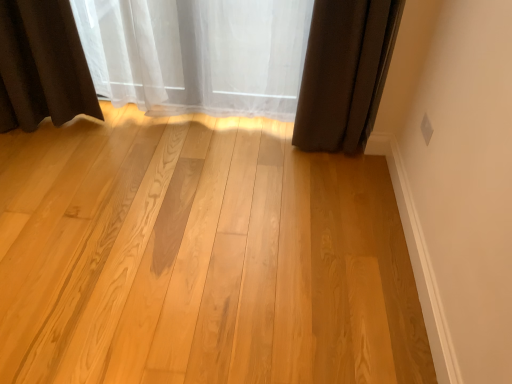
Question: Considering the relative sizes of light wood plank at center and dark brown fabric curtain at upper right, the 1th curtain in the right-to-left sequence, in the image provided, is light wood plank at center bigger than dark brown fabric curtain at upper right, the 1th curtain in the right-to-left sequence,?

Choices:
 (A) yes
 (B) no

Answer: (A)

Question: From a real-world perspective, does light wood plank at center stand above dark brown fabric curtain at upper right, arranged as the second curtain when viewed from the left?

Choices:
 (A) yes
 (B) no

Answer: (B)

Question: Does light wood plank at center lie behind dark brown fabric curtain at upper right, arranged as the second curtain when viewed from the left?

Choices:
 (A) no
 (B) yes

Answer: (A)

Question: Considering the relative positions of light wood plank at center and dark brown fabric curtain at upper right, the 1th curtain in the right-to-left sequence, in the image provided, is light wood plank at center to the right of dark brown fabric curtain at upper right, the 1th curtain in the right-to-left sequence, from the viewer's perspective?

Choices:
 (A) no
 (B) yes

Answer: (A)

Question: Is light wood plank at center shorter than dark brown fabric curtain at upper right, the 1th curtain in the right-to-left sequence?

Choices:
 (A) yes
 (B) no

Answer: (A)

Question: Considering the positions of dark brown fabric curtain at upper right, the 1th curtain in the right-to-left sequence, and light wood plank at center in the image, is dark brown fabric curtain at upper right, the 1th curtain in the right-to-left sequence, wider or thinner than light wood plank at center?

Choices:
 (A) thin
 (B) wide

Answer: (A)

Question: Is dark brown fabric curtain at upper right, the 1th curtain in the right-to-left sequence, to the left or to the right of light wood plank at center in the image?

Choices:
 (A) left
 (B) right

Answer: (B)

Question: Is dark brown fabric curtain at upper right, arranged as the second curtain when viewed from the left, bigger or smaller than light wood plank at center?

Choices:
 (A) small
 (B) big

Answer: (A)

Question: In the image, is dark brown fabric curtain at upper right, the 1th curtain in the right-to-left sequence, positioned in front of or behind light wood plank at center?

Choices:
 (A) behind
 (B) front

Answer: (A)

Question: Is light wood plank at center wider or thinner than white sheer curtain at upper center, arranged as the 2th curtain when viewed from the right?

Choices:
 (A) wide
 (B) thin

Answer: (A)

Question: From the image's perspective, is light wood plank at center located above or below white sheer curtain at upper center, arranged as the 2th curtain when viewed from the right?

Choices:
 (A) below
 (B) above

Answer: (A)

Question: Is light wood plank at center to the left or to the right of white sheer curtain at upper center, arranged as the first curtain when viewed from the left, in the image?

Choices:
 (A) left
 (B) right

Answer: (A)

Question: From their relative heights in the image, would you say light wood plank at center is taller or shorter than white sheer curtain at upper center, arranged as the first curtain when viewed from the left?

Choices:
 (A) tall
 (B) short

Answer: (B)

Question: From a real-world perspective, relative to white sheer curtain at upper center, arranged as the first curtain when viewed from the left, is dark brown fabric curtain at upper right, the 1th curtain in the right-to-left sequence, vertically above or below?

Choices:
 (A) below
 (B) above

Answer: (B)

Question: Is dark brown fabric curtain at upper right, arranged as the second curtain when viewed from the left, inside the boundaries of white sheer curtain at upper center, arranged as the first curtain when viewed from the left, or outside?

Choices:
 (A) inside
 (B) outside

Answer: (B)